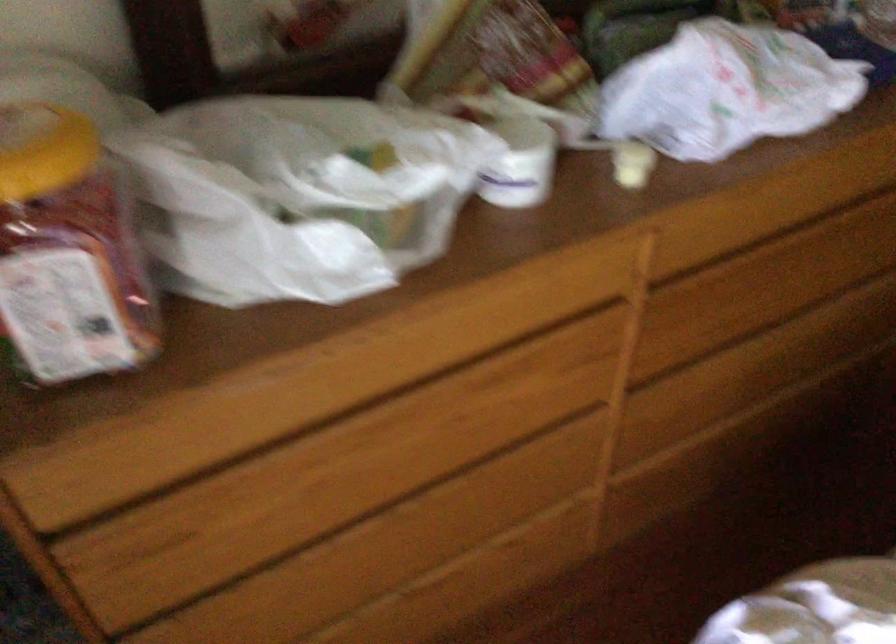
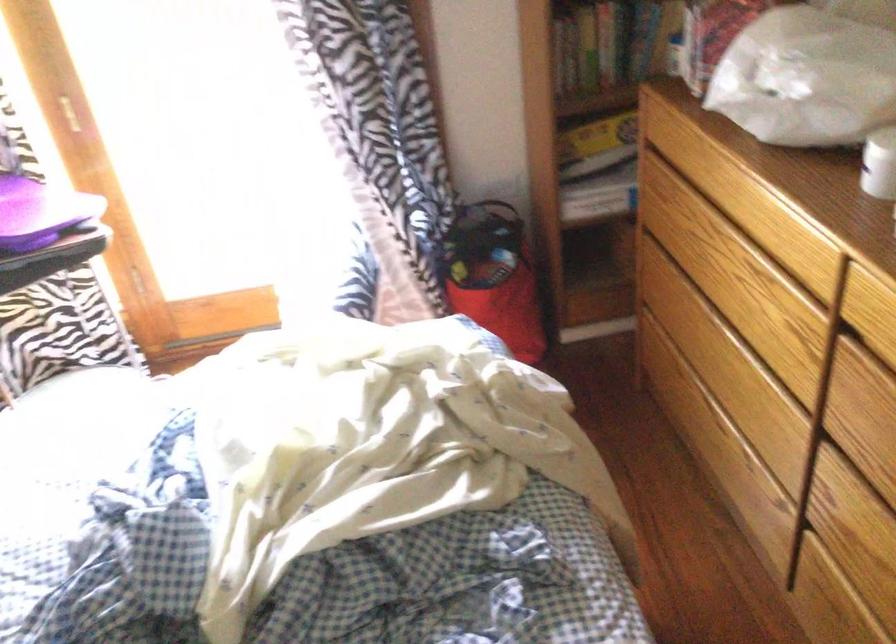
In the second image, find the point that corresponds to point 418,351 in the first image.

(734, 187)